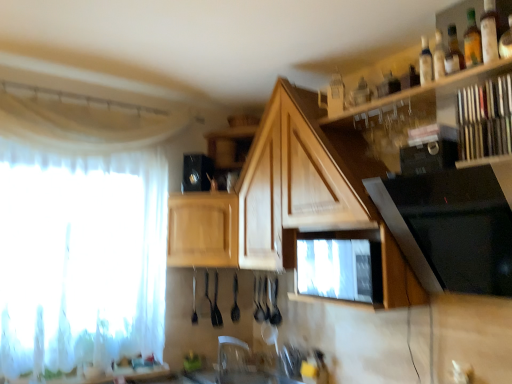
Find the location of a particular element. This screenshot has width=512, height=384. translucent glass bottle at upper right, arranged as the 2th bottle when viewed from the left is located at coordinates (472, 41).

What is the approximate height of translucent glass bottle at upper right, which appears as the 1th bottle when viewed from the front?

translucent glass bottle at upper right, which appears as the 1th bottle when viewed from the front, is 9.36 inches in height.

What is the approximate width of black glossy microwave at upper right, which is the second appliance from left to right?

It is 10.69 centimeters.

Image resolution: width=512 pixels, height=384 pixels. I want to click on black glass stove at upper right, the 3th appliance in the left-to-right sequence, so click(452, 226).

Describe the element at coordinates (452, 226) in the screenshot. This screenshot has width=512, height=384. I see `black glass stove at upper right, the 1th appliance from the right` at that location.

This screenshot has width=512, height=384. What do you see at coordinates (485, 118) in the screenshot?
I see `wooden books at upper right, the first shelf when ordered from right to left` at bounding box center [485, 118].

I want to click on black plastic speaker at upper center, which is the third appliance in right-to-left order, so click(197, 172).

The width and height of the screenshot is (512, 384). What do you see at coordinates (202, 229) in the screenshot?
I see `wooden cabinet at center, acting as the first cabinetry starting from the left` at bounding box center [202, 229].

Find the location of `clear glass bottle at upper right, the first bottle viewed from the back`. clear glass bottle at upper right, the first bottle viewed from the back is located at coordinates (425, 62).

Is black glossy microwave at upper right, which is the second appliance from left to right, beside black plastic speaker at upper center, the first appliance when ordered from back to front?

No, black glossy microwave at upper right, which is the second appliance from left to right, is not beside black plastic speaker at upper center, the first appliance when ordered from back to front.

Looking at this image, considering the sizes of objects black glossy microwave at upper right, the second appliance viewed from the front, and black plastic speaker at upper center, the first appliance when ordered from back to front, in the image provided, who is thinner, black glossy microwave at upper right, the second appliance viewed from the front, or black plastic speaker at upper center, the first appliance when ordered from back to front,?

black glossy microwave at upper right, the second appliance viewed from the front.

Based on the photo, does black glossy microwave at upper right, arranged as the 2th appliance when viewed from the right, come behind black plastic speaker at upper center, which is the third appliance in right-to-left order?

No, it is in front of black plastic speaker at upper center, which is the third appliance in right-to-left order.

The width and height of the screenshot is (512, 384). I want to click on appliance that appears behind the black glossy microwave at upper right, placed as the 2th appliance when sorted from back to front, so click(x=197, y=172).

Is translucent glass bottle at upper right, which appears as the 1th bottle when viewed from the front, taller or shorter than wooden shelf at upper right, marked as the second shelf in a right-to-left arrangement?

In the image, translucent glass bottle at upper right, which appears as the 1th bottle when viewed from the front, appears to be shorter than wooden shelf at upper right, marked as the second shelf in a right-to-left arrangement.

Looking at the image, does translucent glass bottle at upper right, which is counted as the first bottle, starting from the right, seem bigger or smaller compared to wooden shelf at upper right, marked as the second shelf in a right-to-left arrangement?

Clearly, translucent glass bottle at upper right, which is counted as the first bottle, starting from the right, is smaller in size than wooden shelf at upper right, marked as the second shelf in a right-to-left arrangement.

From a real-world perspective, count 2nd bottles upward from the wooden shelf at upper right, marked as the second shelf in a right-to-left arrangement, and point to it. Please provide its 2D coordinates.

[(472, 41)]

How many degrees apart are the facing directions of black glossy microwave at upper right, placed as the 2th appliance when sorted from back to front, and translucent glass bottle at upper right, which appears as the 1th bottle when viewed from the front?

3.64 degrees separate the facing orientations of black glossy microwave at upper right, placed as the 2th appliance when sorted from back to front, and translucent glass bottle at upper right, which appears as the 1th bottle when viewed from the front.

From the image's perspective, who appears lower, black glossy microwave at upper right, the second appliance viewed from the front, or translucent glass bottle at upper right, which appears as the 2th bottle when viewed from the back?

From the image's view, black glossy microwave at upper right, the second appliance viewed from the front, is below.

Which is correct: black glossy microwave at upper right, arranged as the 2th appliance when viewed from the right, is inside translucent glass bottle at upper right, which appears as the 1th bottle when viewed from the front, or outside of it?

black glossy microwave at upper right, arranged as the 2th appliance when viewed from the right, is not inside translucent glass bottle at upper right, which appears as the 1th bottle when viewed from the front, it's outside.

Is black glossy microwave at upper right, placed as the 2th appliance when sorted from back to front, positioned far away from translucent glass bottle at upper right, which is counted as the first bottle, starting from the right?

No, black glossy microwave at upper right, placed as the 2th appliance when sorted from back to front, is not far away from translucent glass bottle at upper right, which is counted as the first bottle, starting from the right.

Is wooden cabinet at center, acting as the second cabinetry starting from the right, thinner than black glossy microwave at upper right, arranged as the 2th appliance when viewed from the right?

In fact, wooden cabinet at center, acting as the second cabinetry starting from the right, might be wider than black glossy microwave at upper right, arranged as the 2th appliance when viewed from the right.

Consider the image. From a real-world perspective, between wooden cabinet at center, acting as the second cabinetry starting from the right, and black glossy microwave at upper right, the second appliance viewed from the front, who is vertically higher?

black glossy microwave at upper right, the second appliance viewed from the front, is physically above.

From their relative heights in the image, would you say wooden cabinet at center, acting as the second cabinetry starting from the right, is taller or shorter than black glossy microwave at upper right, which is the second appliance from left to right?

wooden cabinet at center, acting as the second cabinetry starting from the right, is taller than black glossy microwave at upper right, which is the second appliance from left to right.

Who is smaller, wooden cabinet at center, acting as the first cabinetry starting from the left, or black glossy microwave at upper right, placed as the 2th appliance when sorted from back to front?

black glossy microwave at upper right, placed as the 2th appliance when sorted from back to front, is smaller.

Does point (230, 372) appear closer or farther from the camera than point (464, 55)?

Point (230, 372).

Looking at this image, is clear plastic faucet at center not within translucent glass bottle at upper right, arranged as the 2th bottle when viewed from the left?

Absolutely, clear plastic faucet at center is external to translucent glass bottle at upper right, arranged as the 2th bottle when viewed from the left.

From a real-world perspective, who is located lower, clear plastic faucet at center or translucent glass bottle at upper right, which appears as the 1th bottle when viewed from the front?

clear plastic faucet at center, from a real-world perspective.

Considering the relative positions of clear plastic faucet at center and translucent glass bottle at upper right, which appears as the 2th bottle when viewed from the back, in the image provided, is clear plastic faucet at center to the right of translucent glass bottle at upper right, which appears as the 2th bottle when viewed from the back, from the viewer's perspective?

Incorrect, clear plastic faucet at center is not on the right side of translucent glass bottle at upper right, which appears as the 2th bottle when viewed from the back.

From a real-world perspective, is clear glass bottle at upper right, the 2th bottle positioned from the front, beneath black glass stove at upper right, the 3th appliance in the left-to-right sequence?

No.

At what (x,y) coordinates should I click in order to perform the action: click on bottle that is the 1st one above the black glass stove at upper right, the 3th appliance positioned from the back (from a real-world perspective). Please return your answer as a coordinate pair (x, y). Image resolution: width=512 pixels, height=384 pixels. Looking at the image, I should click on (425, 62).

Does clear glass bottle at upper right, the 2th bottle from the right, have a lesser width compared to black glass stove at upper right, the 3th appliance in the left-to-right sequence?

Yes, clear glass bottle at upper right, the 2th bottle from the right, is thinner than black glass stove at upper right, the 3th appliance in the left-to-right sequence.

Would you say clear glass bottle at upper right, the 2th bottle positioned from the front, is inside or outside black glass stove at upper right, marked as the 1th appliance in a front-to-back arrangement?

clear glass bottle at upper right, the 2th bottle positioned from the front, is not enclosed by black glass stove at upper right, marked as the 1th appliance in a front-to-back arrangement.

Can you confirm if wooden cabinet at center, which is the 2th cabinetry from left to right, is bigger than black glossy microwave at upper right, arranged as the 2th appliance when viewed from the right?

Correct, wooden cabinet at center, which is the 2th cabinetry from left to right, is larger in size than black glossy microwave at upper right, arranged as the 2th appliance when viewed from the right.

From a real-world perspective, which object stands above the other?

From a 3D spatial view, black glossy microwave at upper right, arranged as the 2th appliance when viewed from the right, is above.

Is point (211, 194) closer or farther from the camera than point (443, 139)?

Clearly, point (211, 194) is more distant from the camera than point (443, 139).

In the image, there is a black glossy microwave at upper right, arranged as the 2th appliance when viewed from the right. Where is `appliance above it (from the image's perspective)`? The width and height of the screenshot is (512, 384). appliance above it (from the image's perspective) is located at coordinates (197, 172).

You are a GUI agent. You are given a task and a screenshot of the screen. Output one action in this format:
    pyautogui.click(x=<x>, y=<y>)
    Task: Click on the 2nd bottle above the wooden shelf at upper right, marked as the second shelf in a right-to-left arrangement (from a real-world perspective)
    Image resolution: width=512 pixels, height=384 pixels.
    Given the screenshot: What is the action you would take?
    pyautogui.click(x=472, y=41)

When comparing their distances from white sheer curtain at left, does wooden cabinet at center, acting as the second cabinetry starting from the right, or wooden books at upper right, which appears as the second shelf when viewed from the left, seem closer?

wooden cabinet at center, acting as the second cabinetry starting from the right, lies closer to white sheer curtain at left than the other object.

Which object lies nearer to the anchor point black glossy microwave at upper right, placed as the 2th appliance when sorted from back to front, wooden shelf at upper right, the first shelf viewed from the left, or clear glass bottle at upper right, the 2th bottle from the right?

Among the two, wooden shelf at upper right, the first shelf viewed from the left, is located nearer to black glossy microwave at upper right, placed as the 2th appliance when sorted from back to front.

When comparing their distances from wooden books at upper right, which appears as the second shelf when viewed from the left, does clear plastic faucet at center or black glossy microwave at upper right, arranged as the 2th appliance when viewed from the right, seem closer?

Based on the image, black glossy microwave at upper right, arranged as the 2th appliance when viewed from the right, appears to be nearer to wooden books at upper right, which appears as the second shelf when viewed from the left.

When comparing their distances from wooden books at upper right, the first shelf when ordered from right to left, does black glass stove at upper right, the 3th appliance in the left-to-right sequence, or black glossy microwave at upper right, which is the second appliance from left to right, seem further?

black glass stove at upper right, the 3th appliance in the left-to-right sequence, lies further to wooden books at upper right, the first shelf when ordered from right to left, than the other object.

Considering their positions, is clear plastic faucet at center positioned further to wooden cabinet at center, acting as the 1th cabinetry starting from the right, than wooden books at upper right, which appears as the second shelf when viewed from the left?

clear plastic faucet at center is positioned further to the anchor wooden cabinet at center, acting as the 1th cabinetry starting from the right.

Based on their spatial positions, is wooden books at upper right, the first shelf when ordered from right to left, or black glass stove at upper right, the 3th appliance positioned from the back, closer to wooden shelf at upper right, marked as the second shelf in a right-to-left arrangement?

wooden books at upper right, the first shelf when ordered from right to left, lies closer to wooden shelf at upper right, marked as the second shelf in a right-to-left arrangement, than the other object.

Which object lies nearer to the anchor point translucent glass bottle at upper right, arranged as the 2th bottle when viewed from the left, white sheer curtain at left or black glossy microwave at upper right, the second appliance viewed from the front?

Based on the image, black glossy microwave at upper right, the second appliance viewed from the front, appears to be nearer to translucent glass bottle at upper right, arranged as the 2th bottle when viewed from the left.

From the image, which object appears to be nearer to clear plastic faucet at center, wooden shelf at upper right, the first shelf viewed from the left, or wooden cabinet at center, acting as the 1th cabinetry starting from the right?

wooden cabinet at center, acting as the 1th cabinetry starting from the right, is closer to clear plastic faucet at center.

Where is `faucet located between black glass stove at upper right, the 1th appliance from the right, and wooden cabinet at center, acting as the first cabinetry starting from the left, in the depth direction`? faucet located between black glass stove at upper right, the 1th appliance from the right, and wooden cabinet at center, acting as the first cabinetry starting from the left, in the depth direction is located at coordinates (232, 360).

This screenshot has width=512, height=384. I want to click on faucet between white sheer curtain at left and translucent glass bottle at upper right, which appears as the 1th bottle when viewed from the front, from left to right, so click(232, 360).

Where is `shelf between wooden shelf at upper right, marked as the second shelf in a right-to-left arrangement, and wooden cabinet at center, acting as the second cabinetry starting from the right, along the z-axis`? The image size is (512, 384). shelf between wooden shelf at upper right, marked as the second shelf in a right-to-left arrangement, and wooden cabinet at center, acting as the second cabinetry starting from the right, along the z-axis is located at coordinates (485, 118).

The width and height of the screenshot is (512, 384). I want to click on cabinetry between white sheer curtain at left and wooden cabinet at center, acting as the 1th cabinetry starting from the right, so click(202, 229).